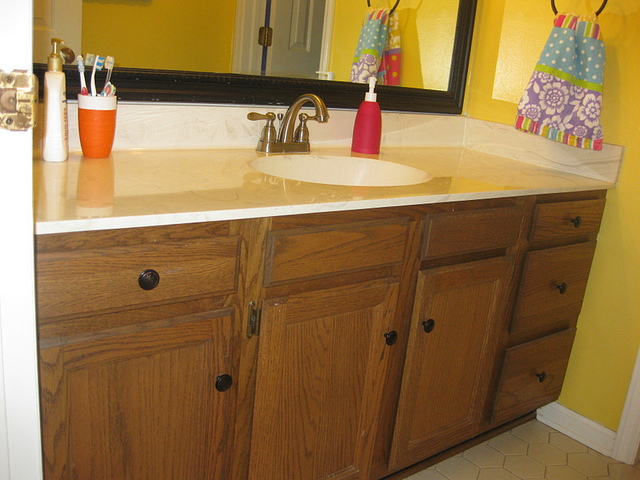
Find the location of a particular element. towel is located at coordinates (x=564, y=77).